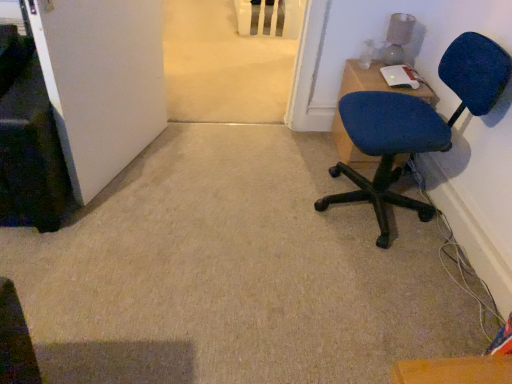
Find the location of a particular element. vacant space that is in between white matte door at lower left and blue fabric chair at right is located at coordinates (211, 184).